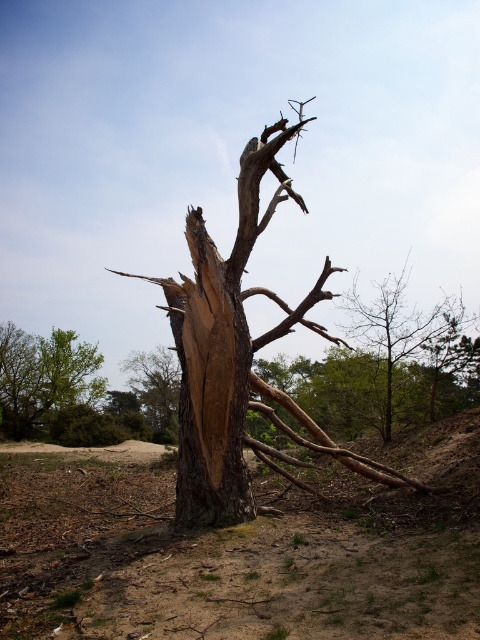
Question: Considering the relative positions of green leafy tree at lower left and smooth brown tree trunk at center in the image provided, where is green leafy tree at lower left located with respect to smooth brown tree trunk at center?

Choices:
 (A) right
 (B) left

Answer: (B)

Question: Which point is farther to the camera?

Choices:
 (A) brown rough bark tree at center
 (B) green leafy tree at lower left
 (C) smooth brown tree trunk at center

Answer: (B)

Question: Which point appears farthest from the camera in this image?

Choices:
 (A) (149, 376)
 (B) (360, 316)
 (C) (181, 342)

Answer: (A)

Question: Is brown sandy soil at center above smooth brown tree trunk at center?

Choices:
 (A) no
 (B) yes

Answer: (A)

Question: Where is green leafy tree at lower left located in relation to smooth brown tree trunk at center in the image?

Choices:
 (A) left
 (B) right

Answer: (A)

Question: Among these points, which one is farthest from the camera?

Choices:
 (A) (36, 625)
 (B) (186, 227)
 (C) (7, 333)

Answer: (C)